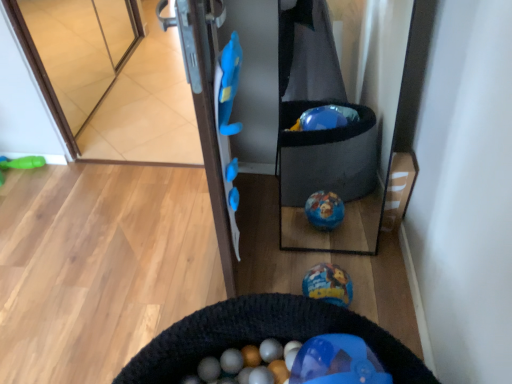
Find the location of a particular element. shiny metallic ball at center, the second toy from the back is located at coordinates pyautogui.click(x=328, y=284).

Identify the location of green rubber toy at left, marked as the 1th toy in a back-to-front arrangement. [x=23, y=162].

This screenshot has height=384, width=512. What do you see at coordinates (80, 49) in the screenshot?
I see `transparent glass door at upper left` at bounding box center [80, 49].

This screenshot has height=384, width=512. What are the coordinates of `shiny metallic ball at center, the 2th toy viewed from the left` in the screenshot? It's located at (328, 284).

Is transparent glass door at upper left not inside shiny metallic ball at center, positioned as the 1th toy in front-to-back order?

Absolutely, transparent glass door at upper left is external to shiny metallic ball at center, positioned as the 1th toy in front-to-back order.

Which of these two, transparent glass door at upper left or shiny metallic ball at center, which is the first toy from bottom to top, is smaller?

shiny metallic ball at center, which is the first toy from bottom to top.

Could you tell me if transparent glass door at upper left is facing shiny metallic ball at center, positioned as the 1th toy in front-to-back order?

No, transparent glass door at upper left is not aimed at shiny metallic ball at center, positioned as the 1th toy in front-to-back order.

In the scene shown: Is transparent glass door at upper left to the left of shiny metallic ball at center, which is counted as the second toy, starting from the top, from the viewer's perspective?

Indeed, transparent glass door at upper left is positioned on the left side of shiny metallic ball at center, which is counted as the second toy, starting from the top.

Can you tell me how much black knitted cat bed at lower center and green rubber toy at left, which is the 2th toy from bottom to top, differ in facing direction?

The angle between the facing direction of black knitted cat bed at lower center and the facing direction of green rubber toy at left, which is the 2th toy from bottom to top, is 84.3 degrees.

From a real-world perspective, is black knitted cat bed at lower center on green rubber toy at left, marked as the 1th toy in a back-to-front arrangement?

Yes, from a real-world perspective, black knitted cat bed at lower center is over green rubber toy at left, marked as the 1th toy in a back-to-front arrangement

Is green rubber toy at left, which is the 2th toy from bottom to top, surrounded by black knitted cat bed at lower center?

No, green rubber toy at left, which is the 2th toy from bottom to top, is not a part of black knitted cat bed at lower center.

Are green rubber toy at left, marked as the 1th toy in a back-to-front arrangement, and black knitted cat bed at lower center located far from each other?

That's right, there is a large distance between green rubber toy at left, marked as the 1th toy in a back-to-front arrangement, and black knitted cat bed at lower center.

Considering the positions of objects green rubber toy at left, which ranks as the 2th toy in right-to-left order, and black knitted cat bed at lower center in the image provided, who is more to the left, green rubber toy at left, which ranks as the 2th toy in right-to-left order, or black knitted cat bed at lower center?

From the viewer's perspective, green rubber toy at left, which ranks as the 2th toy in right-to-left order, appears more on the left side.

From a real-world perspective, is green rubber toy at left, marked as the 1th toy in a left-to-right arrangement, positioned over black knitted cat bed at lower center based on gravity?

Incorrect, from a real-world perspective, green rubber toy at left, marked as the 1th toy in a left-to-right arrangement, is lower than black knitted cat bed at lower center.

Is point (23, 163) closer or farther from the camera than point (228, 325)?

Point (23, 163).

Between green rubber toy at left, which ranks as the 2th toy in right-to-left order, and transparent glass door at upper left, which one appears on the left side from the viewer's perspective?

Positioned to the left is green rubber toy at left, which ranks as the 2th toy in right-to-left order.

From a real-world perspective, is green rubber toy at left, marked as the 1th toy in a back-to-front arrangement, positioned under transparent glass door at upper left based on gravity?

Yes.

Locate an element on the screen. glass door above the green rubber toy at left, marked as the 2th toy in a front-to-back arrangement (from the image's perspective) is located at coordinates (80, 49).

From the image's perspective, is green rubber toy at left, marked as the 1th toy in a left-to-right arrangement, located above or below transparent glass door at upper left?

Based on their image positions, green rubber toy at left, marked as the 1th toy in a left-to-right arrangement, is located beneath transparent glass door at upper left.

From a real-world perspective, is shiny metallic ball at center, which is counted as the first toy, starting from the right, physically below transparent glass door at upper left?

Yes, from a real-world perspective, shiny metallic ball at center, which is counted as the first toy, starting from the right, is below transparent glass door at upper left.

Does shiny metallic ball at center, the 2th toy viewed from the left, turn towards transparent glass door at upper left?

No, shiny metallic ball at center, the 2th toy viewed from the left, does not turn towards transparent glass door at upper left.

From the image's perspective, is shiny metallic ball at center, positioned as the 1th toy in front-to-back order, located above transparent glass door at upper left?

No, from the image's perspective, shiny metallic ball at center, positioned as the 1th toy in front-to-back order, is not above transparent glass door at upper left.

Is shiny metallic ball at center, the second toy from the back, with transparent glass door at upper left?

No, shiny metallic ball at center, the second toy from the back, is not with transparent glass door at upper left.

Which object is further away from the camera taking this photo, transparent glass door at upper left or green rubber toy at left, marked as the 1th toy in a left-to-right arrangement?

green rubber toy at left, marked as the 1th toy in a left-to-right arrangement, is behind.

Is transparent glass door at upper left facing away from green rubber toy at left, which ranks as the 2th toy in right-to-left order?

No.

Can you tell me how much transparent glass door at upper left and green rubber toy at left, which appears as the 1th toy when viewed from the top, differ in facing direction?

The angular difference between transparent glass door at upper left and green rubber toy at left, which appears as the 1th toy when viewed from the top, is 90.5 degrees.

Where is `glass door on the right side of green rubber toy at left, which is the 2th toy from bottom to top`? The height and width of the screenshot is (384, 512). glass door on the right side of green rubber toy at left, which is the 2th toy from bottom to top is located at coordinates (80, 49).

Which object is positioned more to the right, black knitted cat bed at lower center or transparent glass door at upper left?

From the viewer's perspective, black knitted cat bed at lower center appears more on the right side.

The height and width of the screenshot is (384, 512). Find the location of `glass door lying above the black knitted cat bed at lower center (from the image's perspective)`. glass door lying above the black knitted cat bed at lower center (from the image's perspective) is located at coordinates (80, 49).

Is black knitted cat bed at lower center oriented towards transparent glass door at upper left?

No, black knitted cat bed at lower center does not turn towards transparent glass door at upper left.

From the image's perspective, is black knitted cat bed at lower center over transparent glass door at upper left?

Incorrect, from the image's perspective, black knitted cat bed at lower center is lower than transparent glass door at upper left.

At what (x,y) coordinates should I click in order to perform the action: click on toy that is the 1st one below the transparent glass door at upper left (from a real-world perspective). Please return your answer as a coordinate pair (x, y). Looking at the image, I should click on coord(328,284).

What are the coordinates of `cat bed located above the green rubber toy at left, which is the 2th toy from bottom to top (from a real-world perspective)` in the screenshot? It's located at (262, 335).

From the image, which object appears to be nearer to black knitted cat bed at lower center, transparent glass door at upper left or green rubber toy at left, marked as the 2th toy in a front-to-back arrangement?

green rubber toy at left, marked as the 2th toy in a front-to-back arrangement, is closer to black knitted cat bed at lower center.

Based on their spatial positions, is green rubber toy at left, which ranks as the 2th toy in right-to-left order, or transparent glass door at upper left further from black knitted cat bed at lower center?

Based on the image, transparent glass door at upper left appears to be further to black knitted cat bed at lower center.

Consider the image. When comparing their distances from shiny metallic ball at center, the second toy from the back, does black knitted cat bed at lower center or transparent glass door at upper left seem further?

The object further to shiny metallic ball at center, the second toy from the back, is transparent glass door at upper left.

Based on their spatial positions, is black knitted cat bed at lower center or shiny metallic ball at center, which is the first toy from bottom to top, closer to green rubber toy at left, marked as the 2th toy in a front-to-back arrangement?

Among the two, shiny metallic ball at center, which is the first toy from bottom to top, is located nearer to green rubber toy at left, marked as the 2th toy in a front-to-back arrangement.

From the picture: From the image, which object appears to be nearer to transparent glass door at upper left, green rubber toy at left, which is the 2th toy from bottom to top, or black knitted cat bed at lower center?

green rubber toy at left, which is the 2th toy from bottom to top, lies closer to transparent glass door at upper left than the other object.

Looking at the image, which one is located closer to green rubber toy at left, marked as the 1th toy in a left-to-right arrangement, shiny metallic ball at center, the 2th toy viewed from the left, or transparent glass door at upper left?

Based on the image, transparent glass door at upper left appears to be nearer to green rubber toy at left, marked as the 1th toy in a left-to-right arrangement.

Which object lies nearer to the anchor point black knitted cat bed at lower center, transparent glass door at upper left or shiny metallic ball at center, positioned as the 1th toy in front-to-back order?

The object closer to black knitted cat bed at lower center is shiny metallic ball at center, positioned as the 1th toy in front-to-back order.

Based on their spatial positions, is shiny metallic ball at center, which is counted as the first toy, starting from the right, or green rubber toy at left, marked as the 1th toy in a left-to-right arrangement, further from transparent glass door at upper left?

shiny metallic ball at center, which is counted as the first toy, starting from the right, is positioned further to the anchor transparent glass door at upper left.

What are the coordinates of `glass door between green rubber toy at left, which is the 2th toy from bottom to top, and shiny metallic ball at center, which is counted as the first toy, starting from the right, in the horizontal direction` in the screenshot? It's located at (80, 49).

Identify the location of cat bed situated between green rubber toy at left, marked as the 1th toy in a left-to-right arrangement, and shiny metallic ball at center, the second toy from the back, from left to right. This screenshot has width=512, height=384. (262, 335).